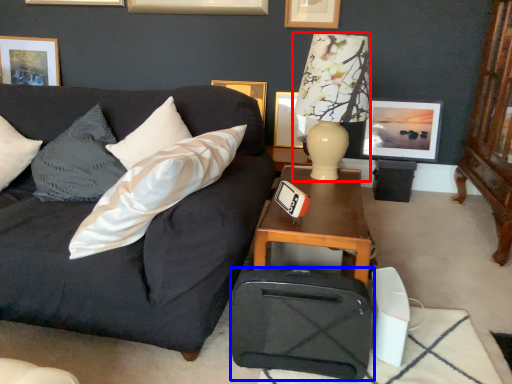
Question: Which point is closer to the camera, table lamp (highlighted by a red box) or luggage (highlighted by a blue box)?

Choices:
 (A) table lamp
 (B) luggage

Answer: (B)